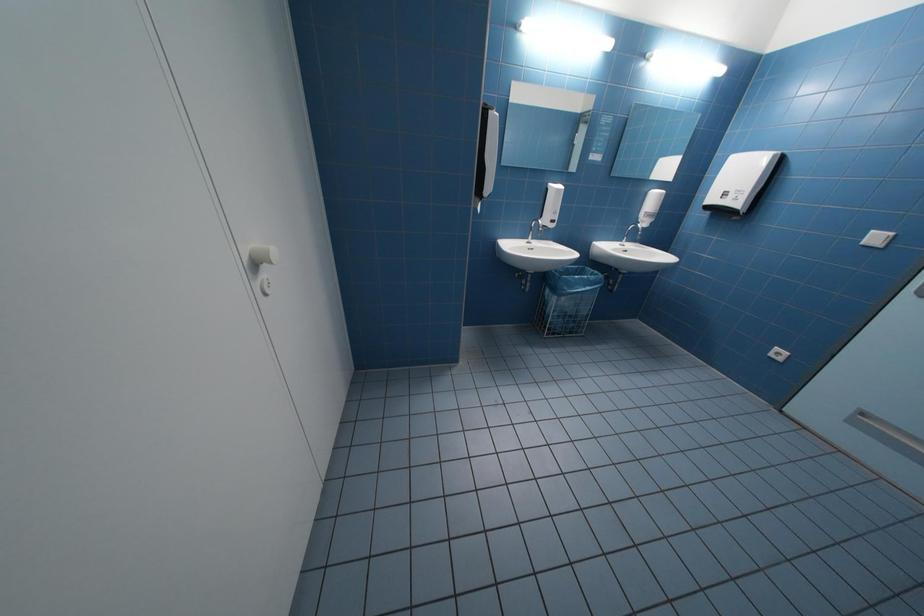
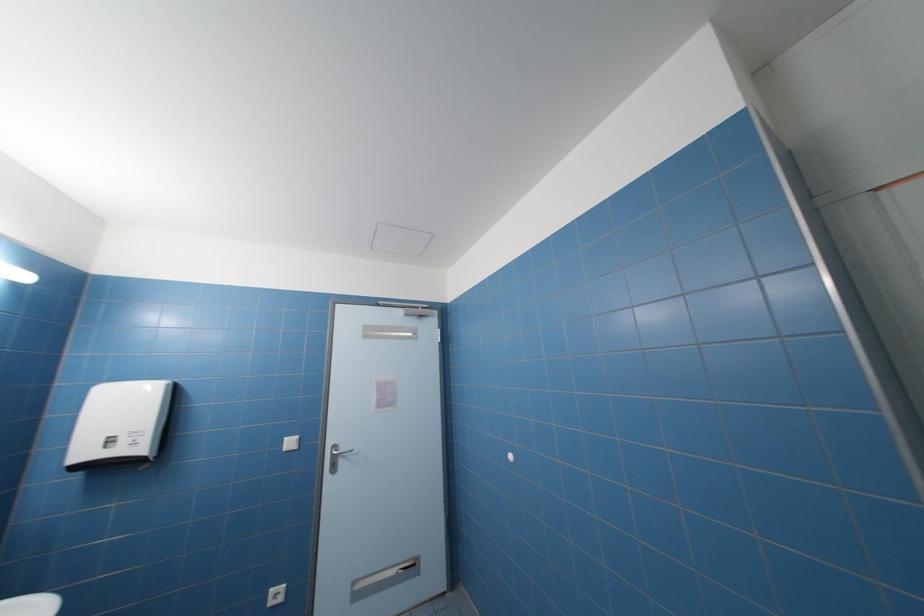
Question: How did the camera likely rotate?

Choices:
 (A) Left
 (B) Right
 (C) Up
 (D) Down

Answer: (B)